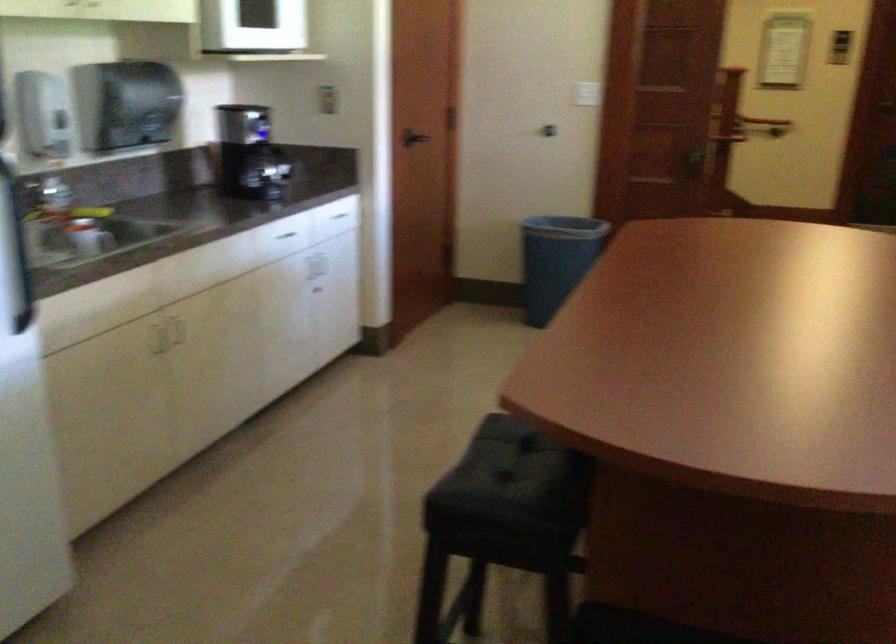
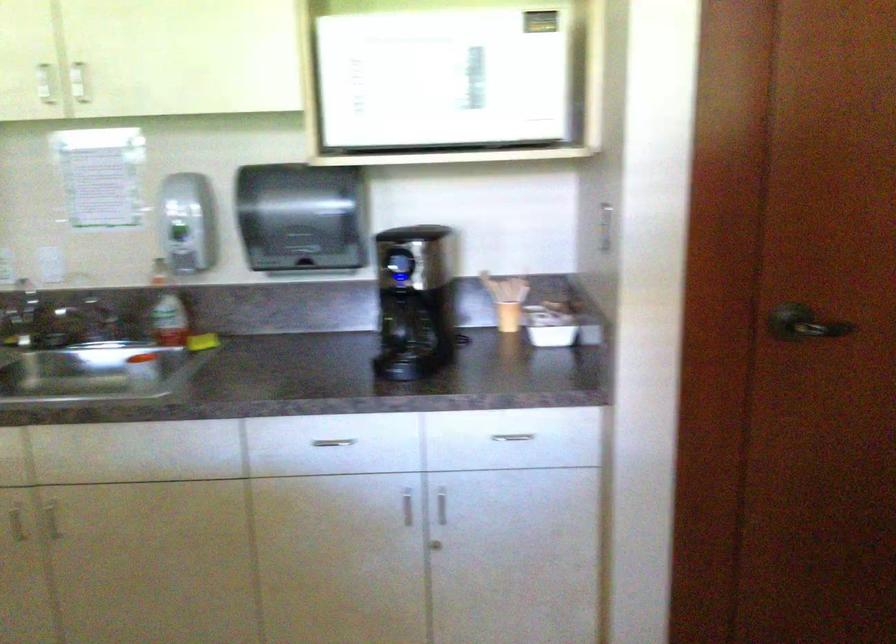
The point at (x=425, y=129) is marked in the first image. Where is the corresponding point in the second image?

(803, 323)